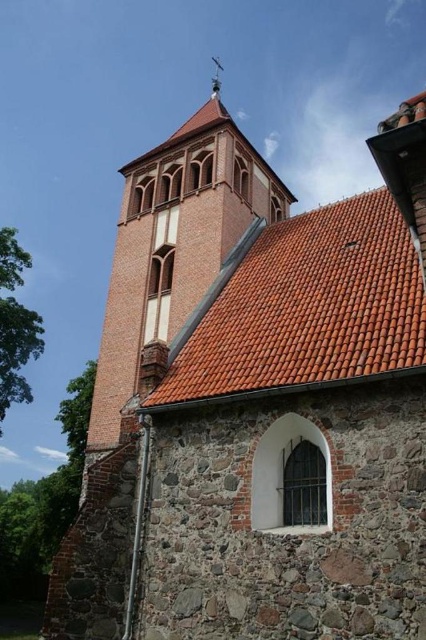
Question: Based on their relative distances, which object is farther from the orange clay tiles at upper center?

Choices:
 (A) light brown stone tower at center
 (B) metallic spire at upper center

Answer: (B)

Question: Does orange clay tiles at upper center appear over light brown stone tower at center?

Choices:
 (A) yes
 (B) no

Answer: (B)

Question: Where is orange clay tiles at upper center located in relation to metallic spire at upper center in the image?

Choices:
 (A) below
 (B) above

Answer: (A)

Question: Which of the following is the farthest from the observer?

Choices:
 (A) orange clay tiles at upper center
 (B) light brown stone tower at center
 (C) metallic spire at upper center

Answer: (C)

Question: Among these points, which one is nearest to the camera?

Choices:
 (A) (x=400, y=312)
 (B) (x=155, y=225)
 (C) (x=219, y=61)

Answer: (A)

Question: Can you confirm if orange clay tiles at upper center is positioned to the left of metallic spire at upper center?

Choices:
 (A) no
 (B) yes

Answer: (A)